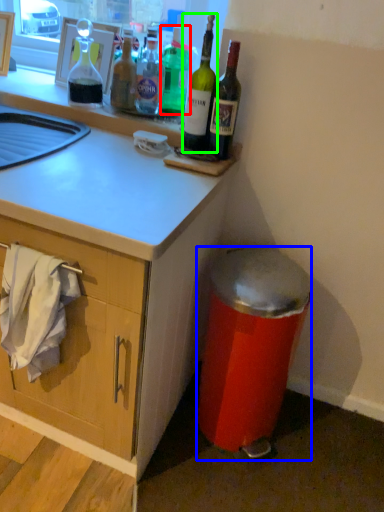
Question: Estimate the real-world distances between objects in this image. Which object is closer to bottle (highlighted by a red box), trash bin/can (highlighted by a blue box) or bottle (highlighted by a green box)?

Choices:
 (A) trash bin/can
 (B) bottle

Answer: (B)